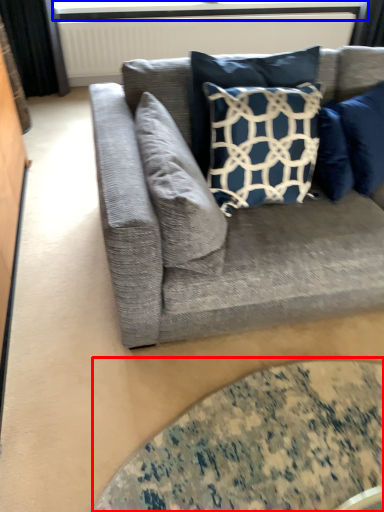
Question: Among these objects, which one is farthest to the camera, glass table (highlighted by a red box) or window screen (highlighted by a blue box)?

Choices:
 (A) glass table
 (B) window screen

Answer: (B)